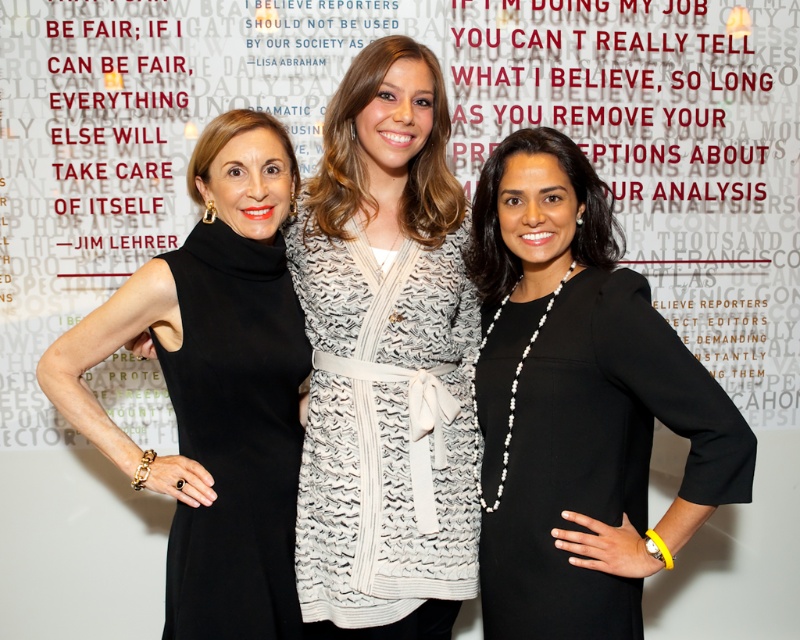
In the scene shown: You are a photographer adjusting the camera height to ensure both the white textured sweater at center and the black matte dress at left are fully visible in the frame. Based on their heights, which one requires the camera to be positioned higher?

The white textured sweater at center is taller than the black matte dress at left, so the camera should be positioned higher to accommodate the taller white textured sweater at center.

You are a photographer adjusting the lighting for a photo shoot. You notice the white textured sweater at center and the black matte dress at left. Which clothing item requires more space between the women to accommodate its width?

The white textured sweater at center requires more space because its width surpasses that of the black matte dress at left.

You are a photographer trying to adjust the lighting to ensure both the black satin dress at center and the white textured sweater at center are visible. Which clothing item might require more careful lighting adjustment due to its size?

The black satin dress at center is larger in size than the white textured sweater at center, so it might require more careful lighting adjustment because larger items can cast bigger shadows and may need more even lighting to avoid overexposure or underexposure.